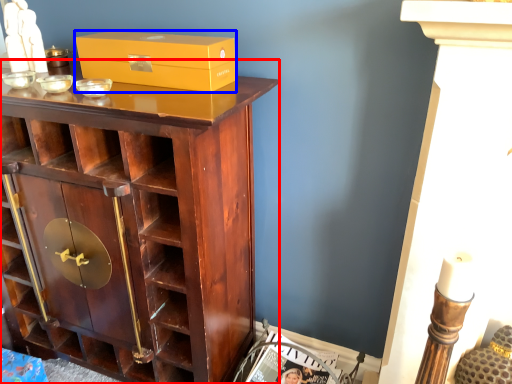
Question: Which object is further to the camera taking this photo, cupboard (highlighted by a red box) or box (highlighted by a blue box)?

Choices:
 (A) cupboard
 (B) box

Answer: (B)